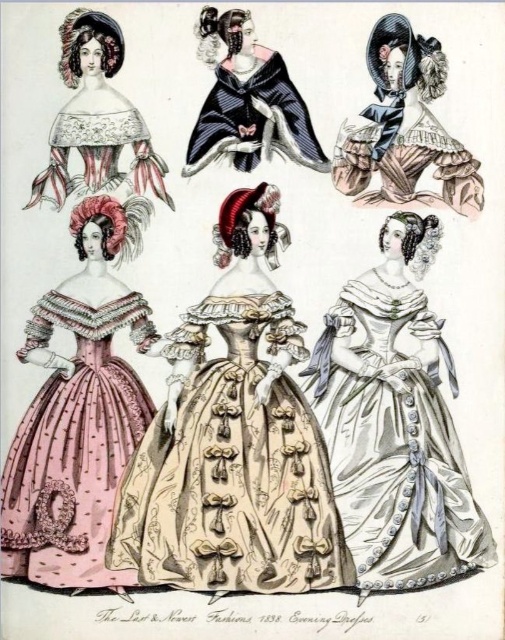
Who is positioned more to the left, beige satin gown at center or matte black cape at upper right?

Positioned to the left is beige satin gown at center.

Between point (246, 321) and point (391, 173), which one is positioned in front?

Point (246, 321) is in front.

I want to click on beige satin gown at center, so click(233, 442).

Identify the location of beige satin gown at center. The height and width of the screenshot is (640, 505). (233, 442).

Which is below, velvet black cape at center or matte lace capelet at upper left?

Positioned lower is matte lace capelet at upper left.

Between point (233, 93) and point (49, 141), which one is positioned behind?

Positioned behind is point (49, 141).

Locate an element on the screen. The width and height of the screenshot is (505, 640). velvet black cape at center is located at coordinates pyautogui.click(x=247, y=100).

Does pink satin dress at left have a greater height compared to velvet black cape at center?

Yes.

At what (x,y) coordinates should I click in order to perform the action: click on pink satin dress at left. Please return your answer as a coordinate pair (x, y). The image size is (505, 640). Looking at the image, I should click on (76, 417).